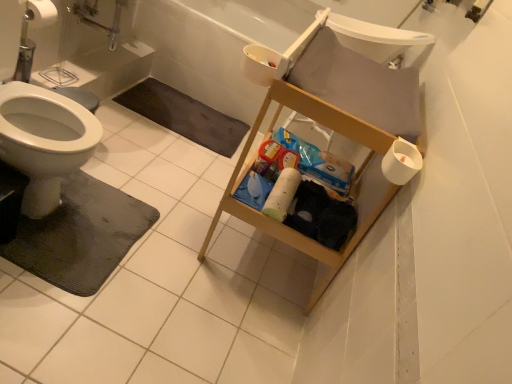
Question: In terms of height, does black rubber bath mat at lower left, acting as the 2th bath mat starting from the bottom, look taller or shorter compared to white matte toilet paper at center, which appears as the 1th toilet paper when viewed from the back?

Choices:
 (A) short
 (B) tall

Answer: (A)

Question: Considering the positions of black rubber bath mat at lower left, acting as the 2th bath mat starting from the front, and white matte toilet paper at center, which appears as the first toilet paper when viewed from the left, in the image, is black rubber bath mat at lower left, acting as the 2th bath mat starting from the front, wider or thinner than white matte toilet paper at center, which appears as the first toilet paper when viewed from the left,?

Choices:
 (A) wide
 (B) thin

Answer: (A)

Question: Based on their relative distances, which object is nearer to the white plastic bathtub at upper center?

Choices:
 (A) white matte toilet paper at center, the 2th toilet paper in the front-to-back sequence
 (B) black rubber bath mat at lower left, which ranks as the second bath mat in back-to-front order
 (C) white matte toilet paper at right, placed as the second toilet paper when sorted from back to front
 (D) white plastic sink at upper right
 (E) black rubber bath mat at lower left, the first bath mat viewed from the back

Answer: (E)

Question: Which object is the farthest from the white matte toilet paper at right, marked as the 1th toilet paper in a right-to-left arrangement?

Choices:
 (A) white matte toilet paper at center, which appears as the first toilet paper when viewed from the left
 (B) white plastic bathtub at upper center
 (C) black rubber bath mat at lower left, which ranks as the 1th bath mat in front-to-back order
 (D) black rubber bath mat at lower left, acting as the 2th bath mat starting from the bottom
 (E) white plastic sink at upper right

Answer: (B)